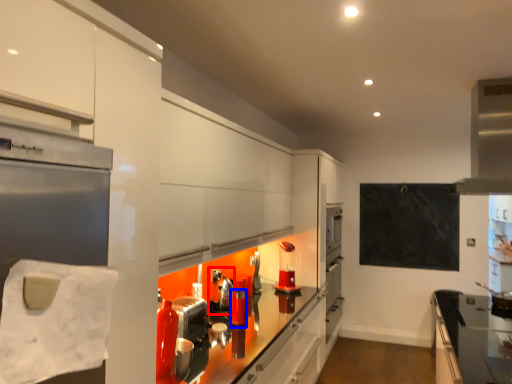
Question: Which object appears farthest to the camera in this image, appliance (highlighted by a red box) or appliance (highlighted by a blue box)?

Choices:
 (A) appliance
 (B) appliance

Answer: (A)